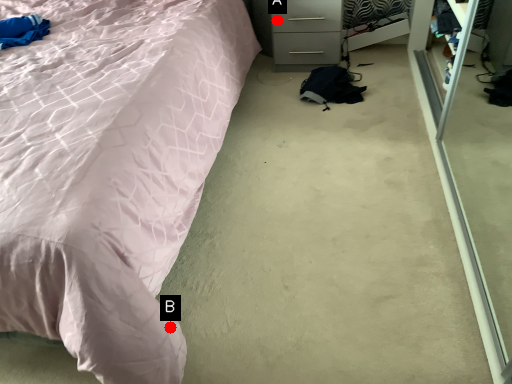
Question: Two points are circled on the image, labeled by A and B beside each circle. Which point appears closest to the camera in this image?

Choices:
 (A) A is closer
 (B) B is closer

Answer: (B)